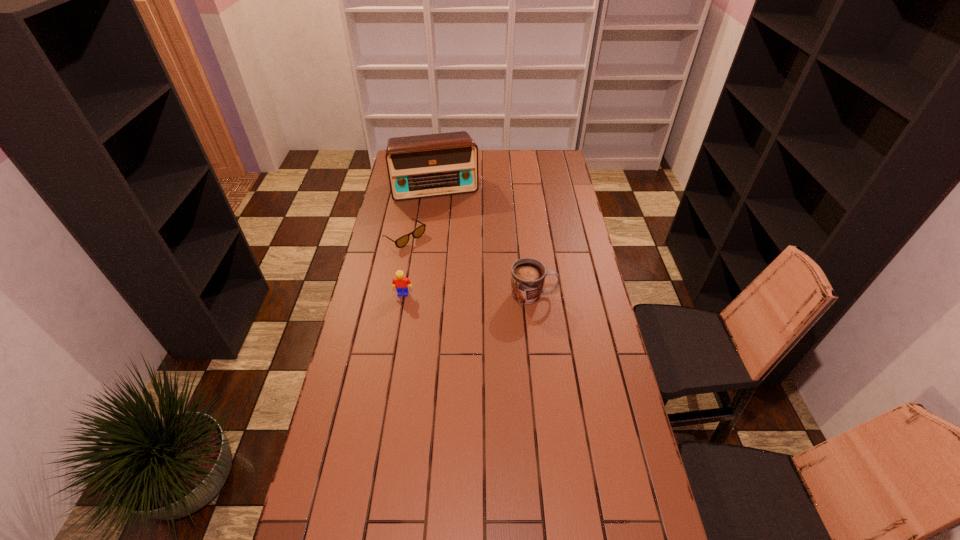
You are a GUI agent. You are given a task and a screenshot of the screen. Output one action in this format:
    pyautogui.click(x=<x>, y=<y>)
    Task: Click on the free area in between the Lego and the mug
    The image size is (960, 540).
    Given the screenshot: What is the action you would take?
    pyautogui.click(x=468, y=294)

You are a GUI agent. You are given a task and a screenshot of the screen. Output one action in this format:
    pyautogui.click(x=<x>, y=<y>)
    Task: Click on the unoccupied position between the rightmost object and the tallest object
    This screenshot has height=540, width=960.
    Given the screenshot: What is the action you would take?
    pyautogui.click(x=485, y=241)

Locate an element on the screen. This screenshot has height=540, width=960. free space between the sunglasses and the radio receiver is located at coordinates (420, 212).

Image resolution: width=960 pixels, height=540 pixels. I want to click on vacant area that lies between the Lego and the radio receiver, so click(420, 240).

The image size is (960, 540). What are the coordinates of `object that is the second closest one to the Lego` in the screenshot? It's located at (528, 275).

Identify which object is located as the second nearest to the Lego. Please provide its 2D coordinates. Your answer should be formatted as a tuple, i.e. [(x, y)], where the tuple contains the x and y coordinates of a point satisfying the conditions above.

[(528, 275)]

Locate an element on the screen. The width and height of the screenshot is (960, 540). vacant space that satisfies the following two spatial constraints: 1. on the front side of the mug; 2. on the side of the sunglasses with the handle is located at coordinates (395, 295).

You are a GUI agent. You are given a task and a screenshot of the screen. Output one action in this format:
    pyautogui.click(x=<x>, y=<y>)
    Task: Click on the vacant space that satisfies the following two spatial constraints: 1. on the front side of the third nearest object; 2. on the side of the rightmost object with the handle
    
    Given the screenshot: What is the action you would take?
    pyautogui.click(x=395, y=295)

Where is `vacant space that satisfies the following two spatial constraints: 1. on the front-facing side of the rightmost object; 2. on the side of the Lego with the handle`? vacant space that satisfies the following two spatial constraints: 1. on the front-facing side of the rightmost object; 2. on the side of the Lego with the handle is located at coordinates (403, 295).

What are the coordinates of `free location that satisfies the following two spatial constraints: 1. on the front side of the mug; 2. on the side of the sunglasses with the handle` in the screenshot? It's located at (395, 295).